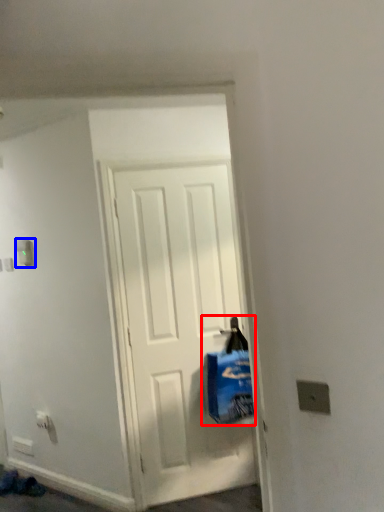
Question: Which of the following is the farthest to the observer, shopping bag (highlighted by a red box) or light switch (highlighted by a blue box)?

Choices:
 (A) shopping bag
 (B) light switch

Answer: (B)